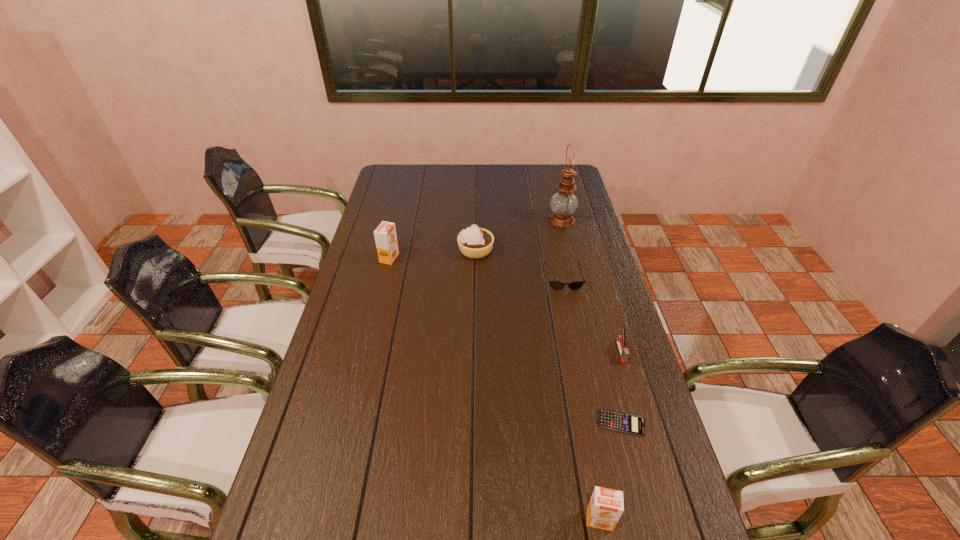
This screenshot has width=960, height=540. What are the coordinates of `vacant region at the right edge` in the screenshot? It's located at (630, 502).

Where is `vacant space at the far right corner of the desktop`? vacant space at the far right corner of the desktop is located at coordinates (541, 165).

The image size is (960, 540). Find the location of `free space between the right orange juice and the farthest object`. free space between the right orange juice and the farthest object is located at coordinates (581, 369).

Identify the location of free space that is in between the second object from left to right and the shortest object. The height and width of the screenshot is (540, 960). (548, 336).

Identify the location of free space between the third tallest object and the fifth tallest object. The width and height of the screenshot is (960, 540). (611, 436).

The image size is (960, 540). What are the coordinates of `empty location between the fifth farthest object and the leftmost object` in the screenshot? It's located at (505, 305).

Find the location of a particular element. empty space between the sixth tallest object and the third nearest object is located at coordinates [x=591, y=315].

You are a GUI agent. You are given a task and a screenshot of the screen. Output one action in this format:
    pyautogui.click(x=<x>, y=<y>)
    Task: Click on the free space between the fourth tallest object and the nearest object
    
    Given the screenshot: What is the action you would take?
    pyautogui.click(x=538, y=385)

Identify the location of vacant space that is in between the sixth tallest object and the fifth tallest object. This screenshot has height=540, width=960. (591, 315).

Locate an element on the screen. This screenshot has width=960, height=540. vacant space that's between the second object from left to right and the right orange juice is located at coordinates (538, 385).